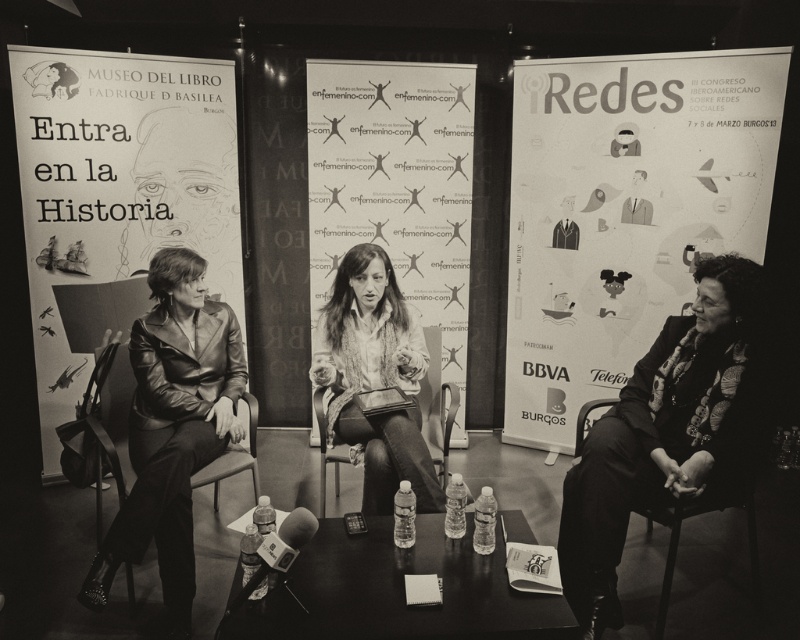
Can you confirm if white paper at center is positioned below leather jacket at center?

Incorrect, white paper at center is not positioned below leather jacket at center.

Can you confirm if white paper at center is positioned to the left of leather jacket at center?

Incorrect, white paper at center is not on the left side of leather jacket at center.

Does point (405, 77) come closer to viewer compared to point (402, 412)?

No, it is not.

Locate an element on the screen. white paper at center is located at coordinates (396, 188).

Is leather jacket at left behind leather jacket at center?

No, it is not.

Is leather jacket at left thinner than leather jacket at center?

Yes, leather jacket at left is thinner than leather jacket at center.

Describe the element at coordinates (172, 429) in the screenshot. I see `leather jacket at left` at that location.

Locate an element on the screen. The width and height of the screenshot is (800, 640). leather jacket at left is located at coordinates (172, 429).

Consider the image. Can you confirm if matte paper poster at right is positioned below matte black banner at left?

No, matte paper poster at right is not below matte black banner at left.

Between point (686, 312) and point (100, 204), which one is positioned behind?

Point (686, 312)

I want to click on matte paper poster at right, so click(x=624, y=212).